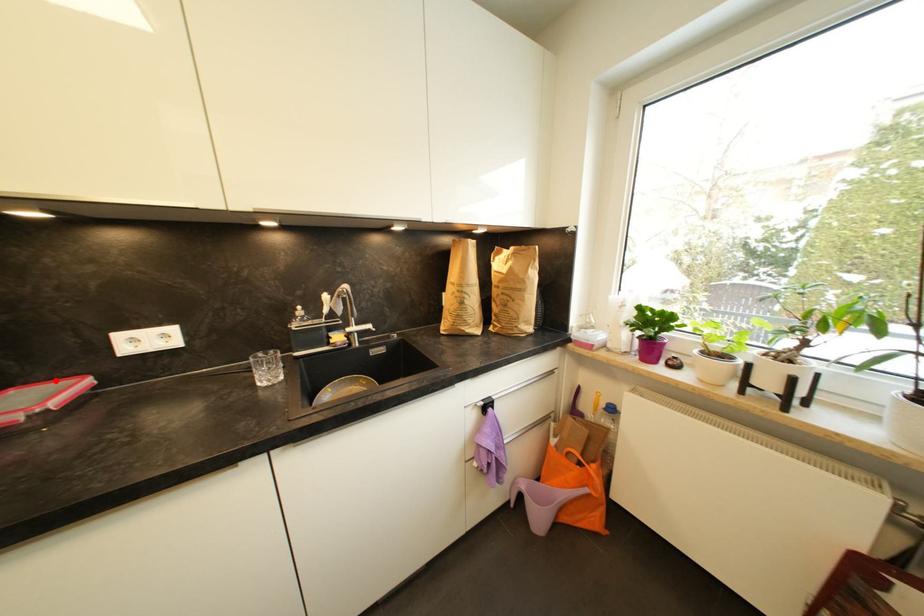
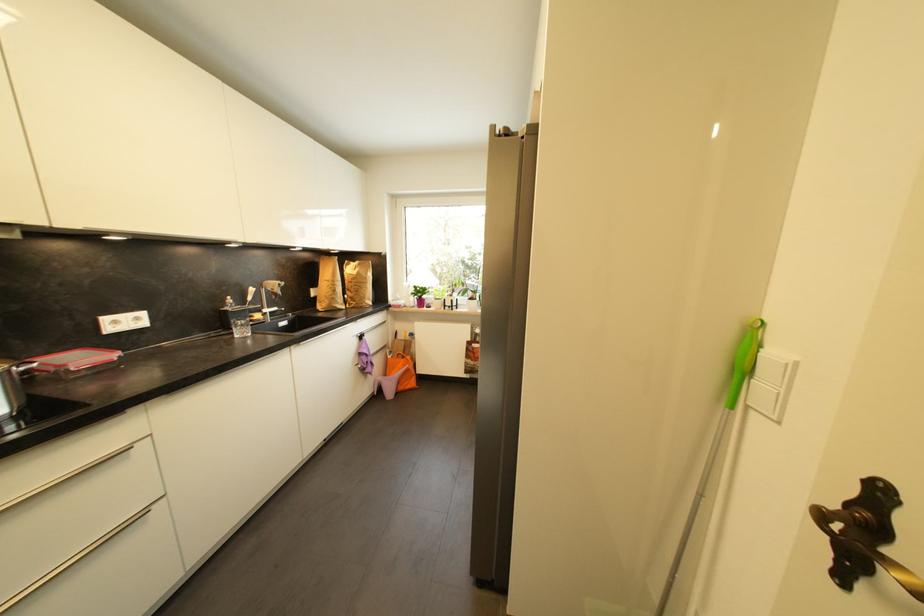
Question: I am providing you with two images of the same scene from different viewpoints. Image1 has a red point marked. In image2, the corresponding 3D location appears at what relative position? Reply with the corresponding letter.

Choices:
 (A) Closer
 (B) Farther

Answer: (B)